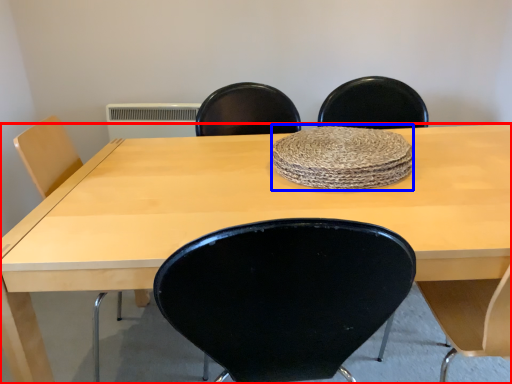
Question: Which object is closer to the camera taking this photo, table (highlighted by a red box) or mat (highlighted by a blue box)?

Choices:
 (A) table
 (B) mat

Answer: (A)